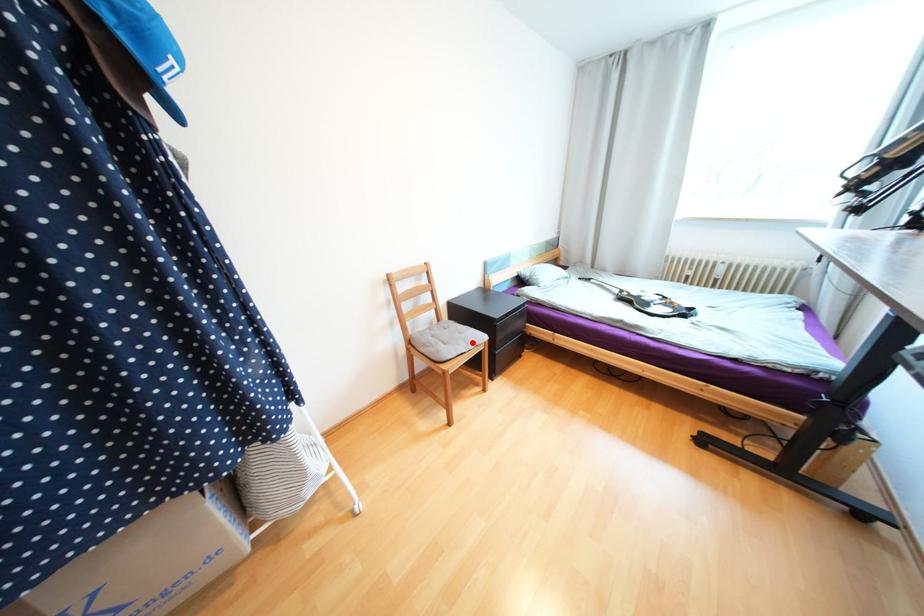
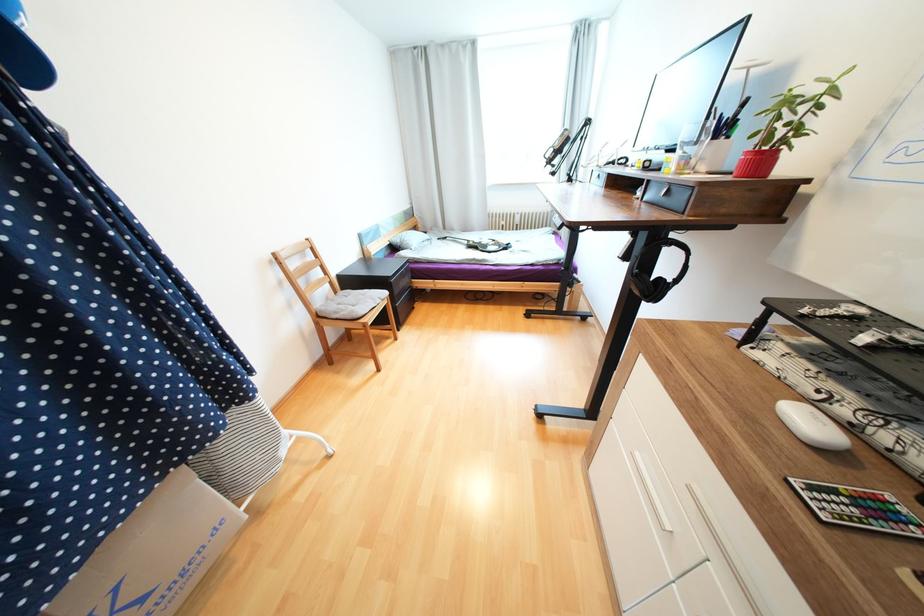
Where in the second image is the point corresponding to the highlighted location from the first image?

(379, 300)